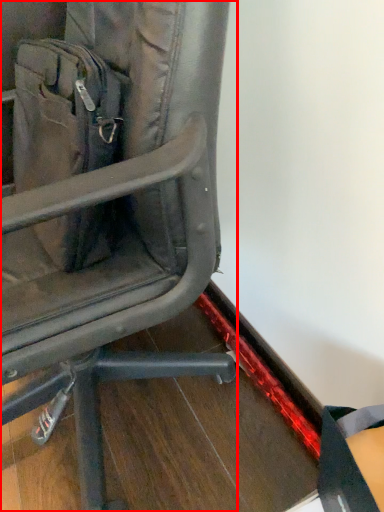
Question: From the image's perspective, considering the relative positions of chair (annotated by the red box) and messenger bag in the image provided, where is chair (annotated by the red box) located with respect to the staircase?

Choices:
 (A) below
 (B) above

Answer: (A)